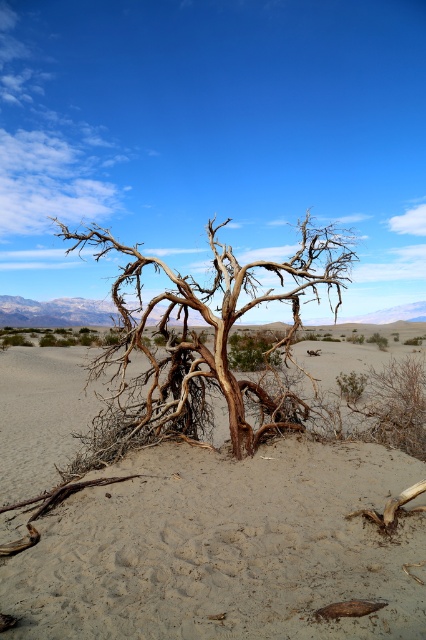
Does point (215, 628) come closer to viewer compared to point (161, 330)?

Yes, point (215, 628) is in front of point (161, 330).

Who is positioned more to the left, brown sandy soil at center or brown textured tree at center?

brown sandy soil at center

The image size is (426, 640). Identify the location of brown sandy soil at center. (224, 547).

Identify the location of brown sandy soil at center. (224, 547).